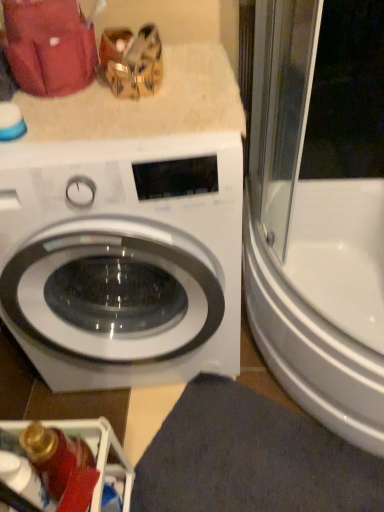
Identify the location of empty space that is ontop of white glossy washing machine at center (from a real-world perspective). (110, 112).